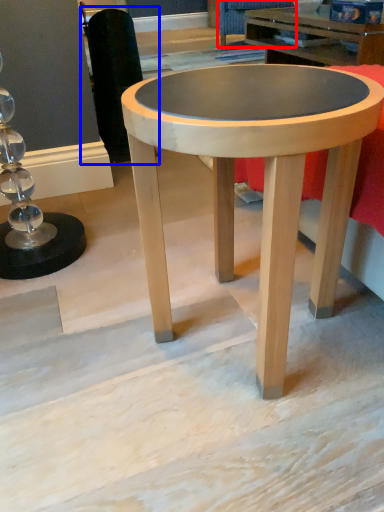
Question: Among these objects, which one is nearest to the camera, swivel chair (highlighted by a red box) or swivel chair (highlighted by a blue box)?

Choices:
 (A) swivel chair
 (B) swivel chair

Answer: (B)